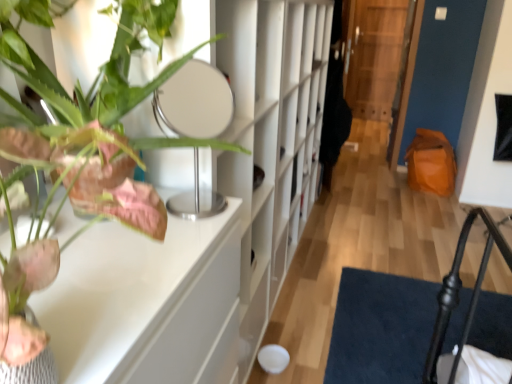
Question: Considering the positions of white glossy table at upper left and transparent wooden door at center in the image, is white glossy table at upper left taller or shorter than transparent wooden door at center?

Choices:
 (A) tall
 (B) short

Answer: (B)

Question: Considering the positions of point (183, 316) and point (372, 114), is point (183, 316) closer or farther from the camera than point (372, 114)?

Choices:
 (A) closer
 (B) farther

Answer: (A)

Question: Which object is the farthest from the white glossy table at upper left?

Choices:
 (A) transparent wooden door at center
 (B) white matte bookshelf at center
 (C) green matte plant at upper left

Answer: (A)

Question: Which is farther from the white matte bookshelf at center?

Choices:
 (A) green matte plant at upper left
 (B) white glossy table at upper left
 (C) transparent wooden door at center

Answer: (C)